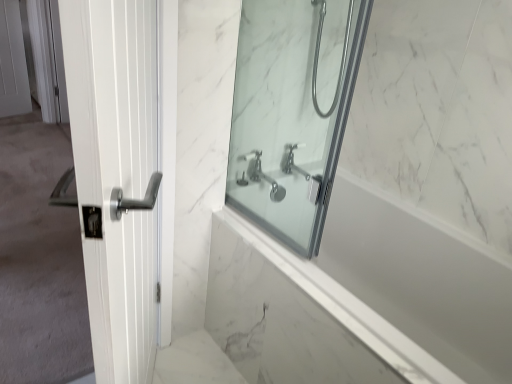
Question: Looking at the image, does white glossy door handle at left seem bigger or smaller compared to white marble bathtub at center?

Choices:
 (A) big
 (B) small

Answer: (B)

Question: Does point (159, 178) appear closer or farther from the camera than point (433, 311)?

Choices:
 (A) closer
 (B) farther

Answer: (A)

Question: Considering the real-world distances, which object is farthest from the chrome metallic faucet at center?

Choices:
 (A) white glossy door handle at left
 (B) satin nickel showerhead at upper center
 (C) white marble bathtub at center
 (D) white glossy door handle at left
 (E) clear glass shower door at center

Answer: (D)

Question: Estimate the real-world distances between objects in this image. Which object is farther from the satin nickel showerhead at upper center?

Choices:
 (A) clear glass shower door at center
 (B) white glossy door handle at left
 (C) white glossy door handle at left
 (D) chrome metallic faucet at center
 (E) white marble bathtub at center

Answer: (C)